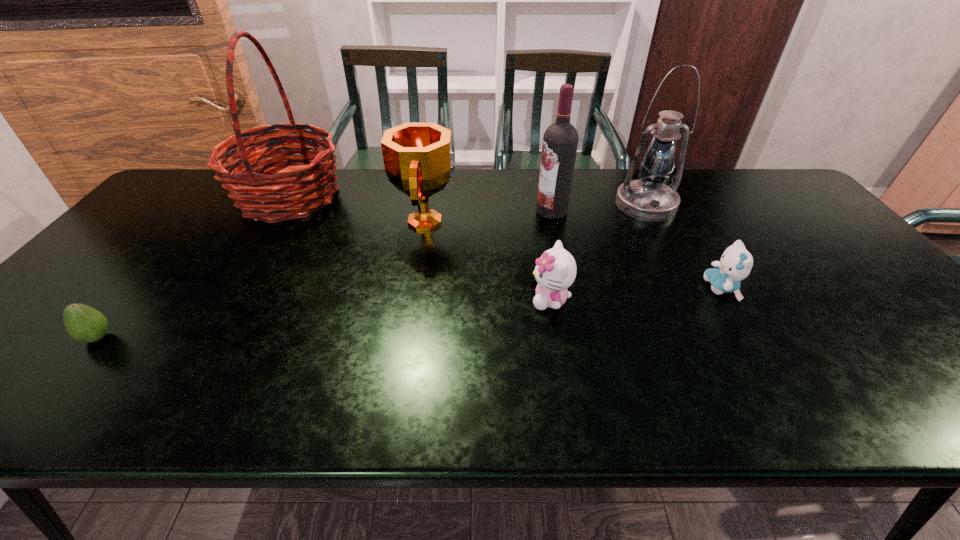
In the image, there is a desktop. At what (x,y) coordinates should I click in order to perform the action: click on free space at the left edge. Please return your answer as a coordinate pair (x, y). Image resolution: width=960 pixels, height=540 pixels. Looking at the image, I should click on (136, 231).

Locate an element on the screen. The width and height of the screenshot is (960, 540). vacant area at the far left corner of the desktop is located at coordinates (187, 185).

The image size is (960, 540). In the image, there is a desktop. What are the coordinates of `vacant space at the far right corner` in the screenshot? It's located at (756, 171).

Locate an element on the screen. The height and width of the screenshot is (540, 960). vacant region between the third object from left to right and the right kitten is located at coordinates (574, 254).

At what (x,y) coordinates should I click in order to perform the action: click on free space between the shorter kitten and the basket. Please return your answer as a coordinate pair (x, y). Image resolution: width=960 pixels, height=540 pixels. Looking at the image, I should click on (505, 242).

The width and height of the screenshot is (960, 540). Find the location of `free point between the shorter kitten and the oil lamp`. free point between the shorter kitten and the oil lamp is located at coordinates (684, 246).

This screenshot has height=540, width=960. I want to click on free spot between the wine bottle and the leftmost object, so click(x=324, y=274).

You are a GUI agent. You are given a task and a screenshot of the screen. Output one action in this format:
    pyautogui.click(x=<x>, y=<y>)
    Task: Click on the vacant region between the nearest object and the oil lamp
    
    Given the screenshot: What is the action you would take?
    pyautogui.click(x=372, y=271)

The width and height of the screenshot is (960, 540). Find the location of `blank region between the oil lamp and the sixth tallest object`. blank region between the oil lamp and the sixth tallest object is located at coordinates (684, 246).

Find the location of a particular element. The height and width of the screenshot is (540, 960). empty location between the wine bottle and the fourth tallest object is located at coordinates (489, 216).